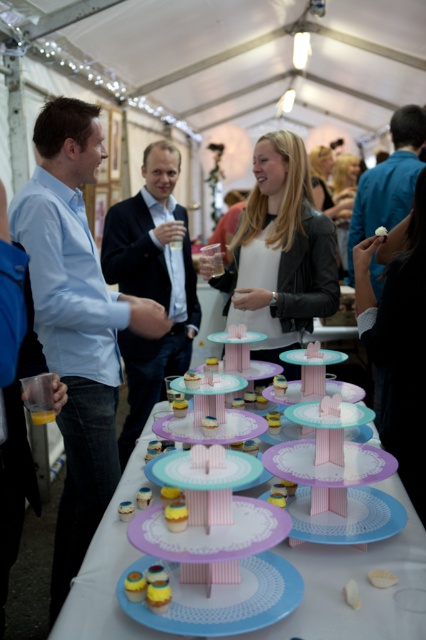
You are at the gathering and want to take a photo of the pink frosted cake at center without any obstructions. Since you are standing in front of the leather jacket at center, can you move behind it to get a clear shot?

The pink frosted cake at center is behind the leather jacket at center, so yes, moving behind the leather jacket at center would allow you to take a clear photo of the pink frosted cake at center without any obstruction.

You are standing at the entrance of the tent and want to reach the cupcakes on the table. There are two points marked in the scene, point 1 at coordinates point (x=307, y=490) and point 2 at coordinates point (x=383, y=570). Which point should you pass through first to reach the cupcakes?

You should pass through point 2 at coordinates point (x=383, y=570) first because point 1 at coordinates point (x=307, y=490) is behind it, meaning point 2 is closer to your starting position at the entrance.

Looking at this image, you are at the gathering and want to move from the entrance to the table with the cupcakes. There is a leather jacket at center and a blue fabric at right in your way. Which object should you move around to reach the table?

Since the leather jacket at center is to the left of blue fabric at right, you should move around the blue fabric at right to reach the table as it is on the right side closer to the entrance path.